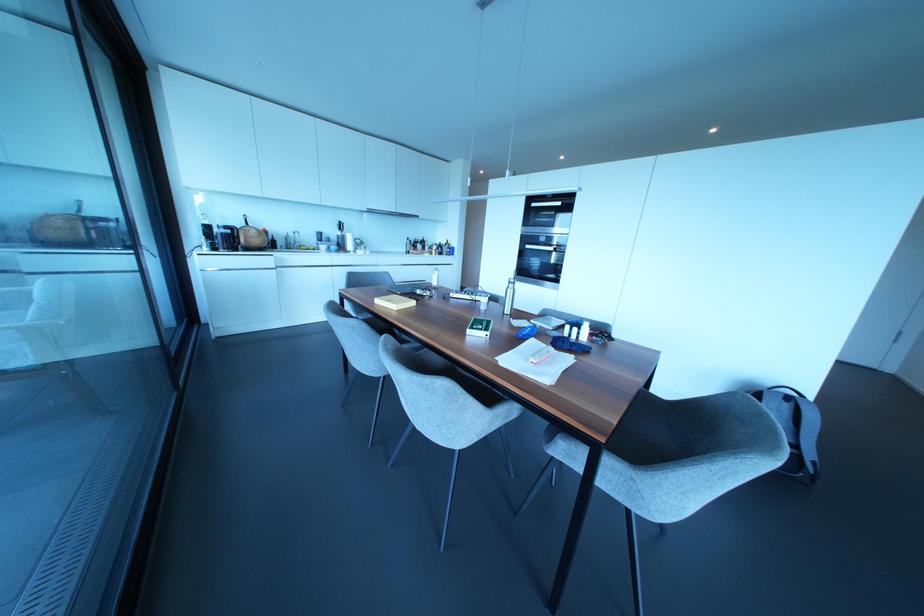
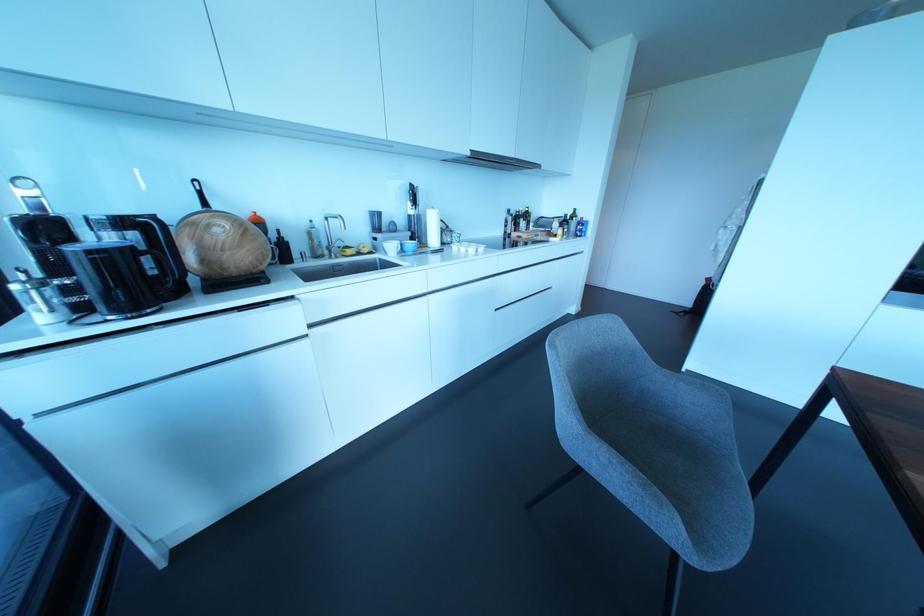
The point at (338, 233) is marked in the first image. Where is the corresponding point in the second image?

(410, 211)